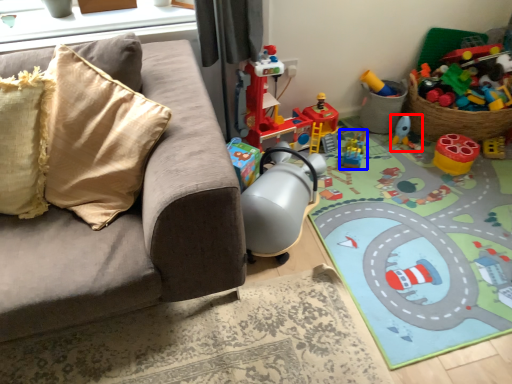
Question: Among these objects, which one is farthest to the camera, toy (highlighted by a red box) or toy (highlighted by a blue box)?

Choices:
 (A) toy
 (B) toy

Answer: (A)